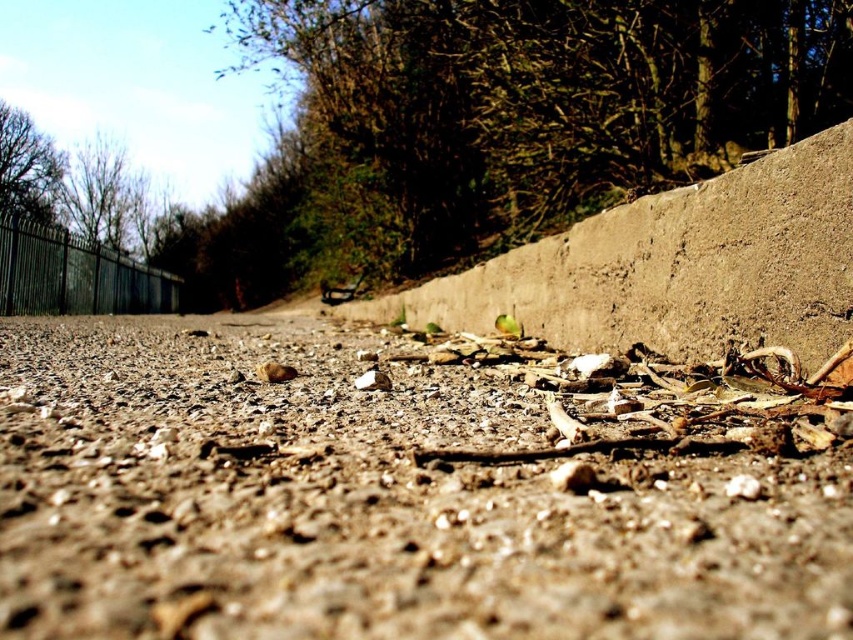
You are a drone operator trying to land a drone on the ground. The drone has a GPS coordinate system where the bottom left corner of the image is the origin point. The drone needs to land precisely at the location of the brown gravel at center. What are the coordinates where you should direct the drone to land?

The coordinates for the brown gravel at center are at point (370, 502), so you should direct the drone to land there.

You are a hiker trying to cross the path shown in the image. You notice the brown gravel at center and the gray concrete wall at center. Which object is closer to the forested area in the background?

The brown gravel at center is positioned under the gray concrete wall at center, meaning the gravel is closer to the forested area while the wall is further back.